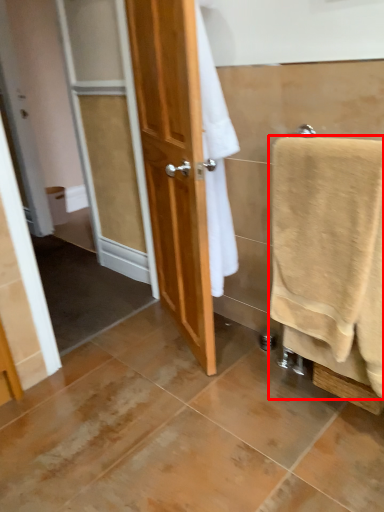
Question: From the image's perspective, where is towel (annotated by the red box) located relative to toilet paper?

Choices:
 (A) below
 (B) above

Answer: (A)